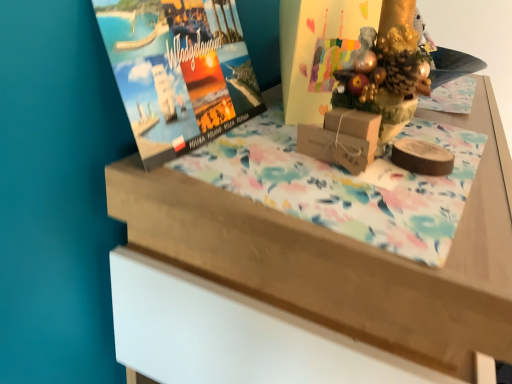
Where is `vacant space in front of brown cardboard box at center`? vacant space in front of brown cardboard box at center is located at coordinates (354, 215).